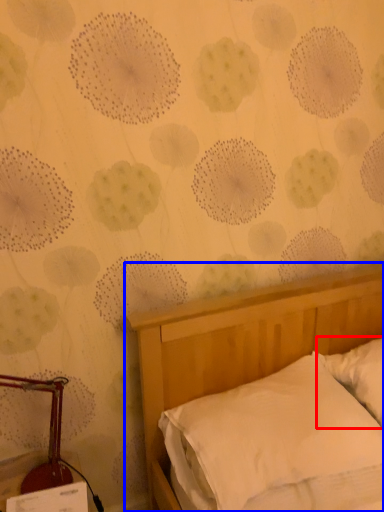
Question: Which point is further to the camera, pillow (highlighted by a red box) or bed (highlighted by a blue box)?

Choices:
 (A) pillow
 (B) bed

Answer: (A)